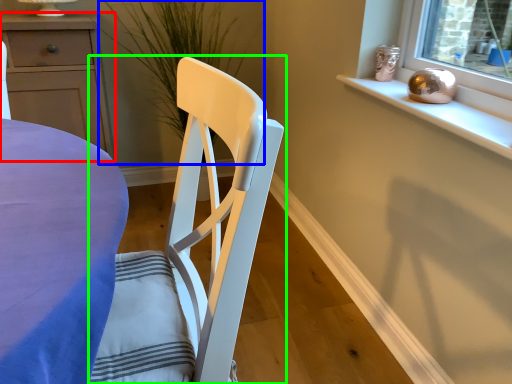
Question: Estimate the real-world distances between objects in this image. Which object is closer to cabinetry (highlighted by a red box), plant (highlighted by a blue box) or chair (highlighted by a green box)?

Choices:
 (A) plant
 (B) chair

Answer: (A)